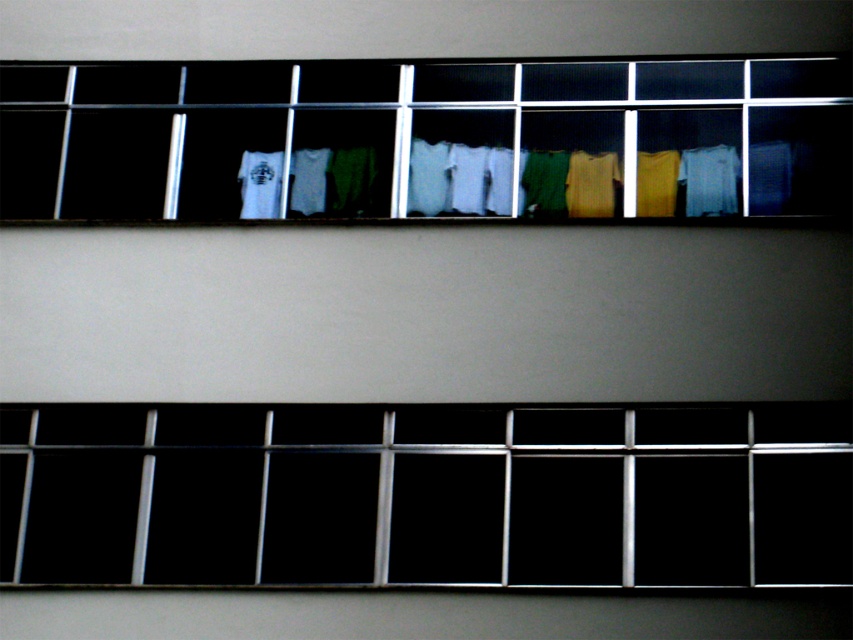
Question: Does transparent glass at center appear under matte yellow sweater at center?

Choices:
 (A) no
 (B) yes

Answer: (B)

Question: Is transparent glass at center bigger than white fabric at center?

Choices:
 (A) yes
 (B) no

Answer: (B)

Question: Which of these objects is positioned closest to the transparent glass at center?

Choices:
 (A) white cotton shirt at right
 (B) matte yellow sweater at center

Answer: (B)

Question: Which point appears farthest from the camera in this image?

Choices:
 (A) (189, 106)
 (B) (267, 468)

Answer: (A)

Question: Can you confirm if transparent glass at center is smaller than white fabric at center?

Choices:
 (A) yes
 (B) no

Answer: (A)

Question: Estimate the real-world distances between objects in this image. Which object is closer to the matte yellow sweater at center?

Choices:
 (A) white fabric at center
 (B) transparent glass at center

Answer: (A)